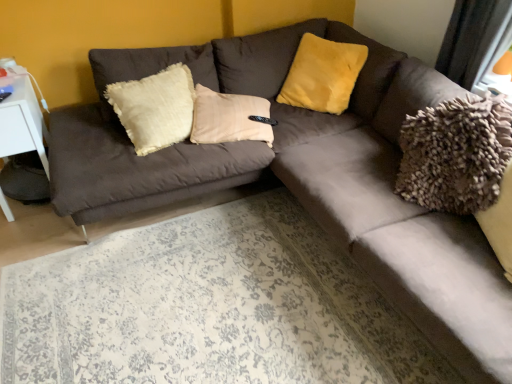
Question: Is white plastic table at left touching yellow fuzzy pillow at upper center?

Choices:
 (A) no
 (B) yes

Answer: (A)

Question: Is white plastic table at left far from yellow fuzzy pillow at upper center?

Choices:
 (A) no
 (B) yes

Answer: (B)

Question: Is white plastic table at left positioned behind yellow fuzzy pillow at upper center?

Choices:
 (A) no
 (B) yes

Answer: (A)

Question: Is white plastic table at left taller than yellow fuzzy pillow at upper center?

Choices:
 (A) yes
 (B) no

Answer: (A)

Question: From the image's perspective, is white plastic table at left below yellow fuzzy pillow at upper center?

Choices:
 (A) yes
 (B) no

Answer: (A)

Question: Is yellow fuzzy pillow at upper center a part of white plastic table at left?

Choices:
 (A) yes
 (B) no

Answer: (B)

Question: Is yellow fuzzy pillow at upper center at the right side of white plastic table at left?

Choices:
 (A) no
 (B) yes

Answer: (B)

Question: Is yellow fuzzy pillow at upper center closer to the viewer compared to white plastic table at left?

Choices:
 (A) yes
 (B) no

Answer: (B)

Question: Considering the relative sizes of yellow fuzzy pillow at upper center and white plastic table at left in the image provided, is yellow fuzzy pillow at upper center thinner than white plastic table at left?

Choices:
 (A) yes
 (B) no

Answer: (A)

Question: From a real-world perspective, does yellow fuzzy pillow at upper center stand above white plastic table at left?

Choices:
 (A) no
 (B) yes

Answer: (B)

Question: Is yellow fuzzy pillow at upper center to the left of white plastic table at left from the viewer's perspective?

Choices:
 (A) yes
 (B) no

Answer: (B)

Question: Is yellow fuzzy pillow at upper center aimed at white plastic table at left?

Choices:
 (A) yes
 (B) no

Answer: (B)

Question: In terms of width, does yellow fuzzy pillow at upper center look wider or thinner when compared to white plastic table at left?

Choices:
 (A) wide
 (B) thin

Answer: (B)